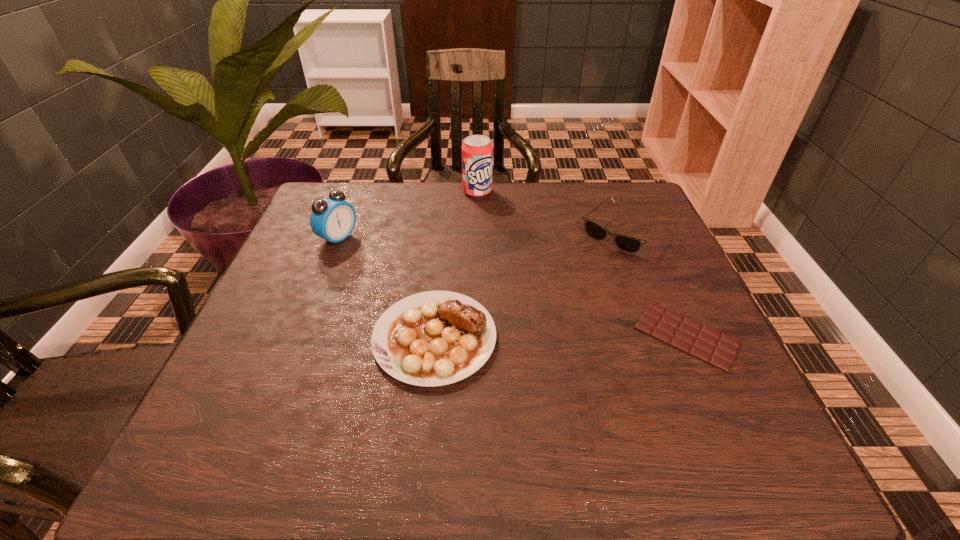
You are a GUI agent. You are given a task and a screenshot of the screen. Output one action in this format:
    pyautogui.click(x=<x>, y=<y>)
    Task: Click on the sunglasses that is at the far edge
    
    Given the screenshot: What is the action you would take?
    pyautogui.click(x=629, y=244)

This screenshot has height=540, width=960. I want to click on steak situated at the near edge, so click(434, 338).

The width and height of the screenshot is (960, 540). I want to click on chocolate bar located in the near edge section of the desktop, so click(718, 349).

The width and height of the screenshot is (960, 540). I want to click on object located at the left edge, so click(x=333, y=219).

In order to click on chocolate bar situated at the right edge in this screenshot , I will do `click(718, 349)`.

The height and width of the screenshot is (540, 960). What are the coordinates of `sunglasses that is at the right edge` in the screenshot? It's located at (629, 244).

The width and height of the screenshot is (960, 540). I want to click on object positioned at the far left corner, so click(333, 219).

The width and height of the screenshot is (960, 540). Identify the location of object that is at the far right corner. (629, 244).

Identify the location of object present at the near right corner. This screenshot has width=960, height=540. (x=718, y=349).

Locate an element on the screen. The width and height of the screenshot is (960, 540). vacant space at the far edge of the desktop is located at coordinates click(x=476, y=225).